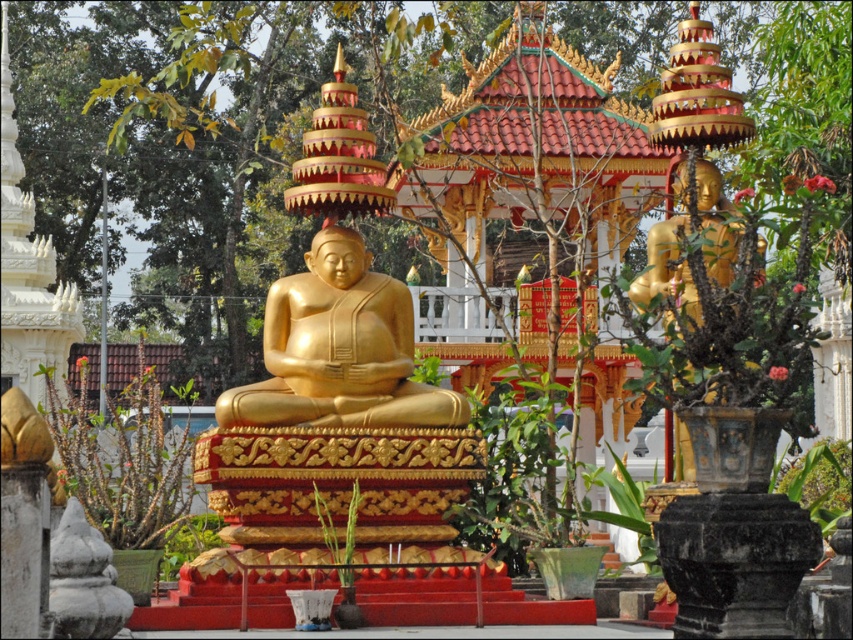
Can you confirm if gold polished statue at center is positioned to the right of gold polished statue at right?

In fact, gold polished statue at center is to the left of gold polished statue at right.

I want to click on gold polished statue at center, so click(x=339, y=349).